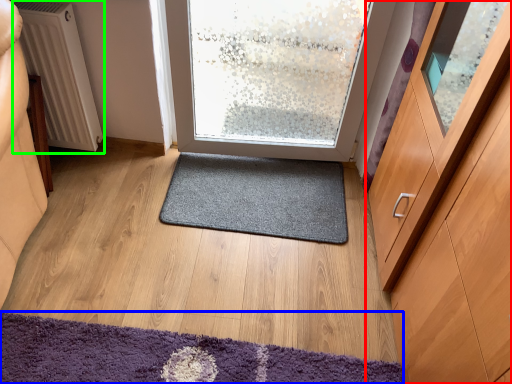
Question: Which object is the farthest from cabinetry (highlighted by a red box)? Choose among these: mat (highlighted by a blue box) or radiator (highlighted by a green box).

Choices:
 (A) mat
 (B) radiator

Answer: (B)